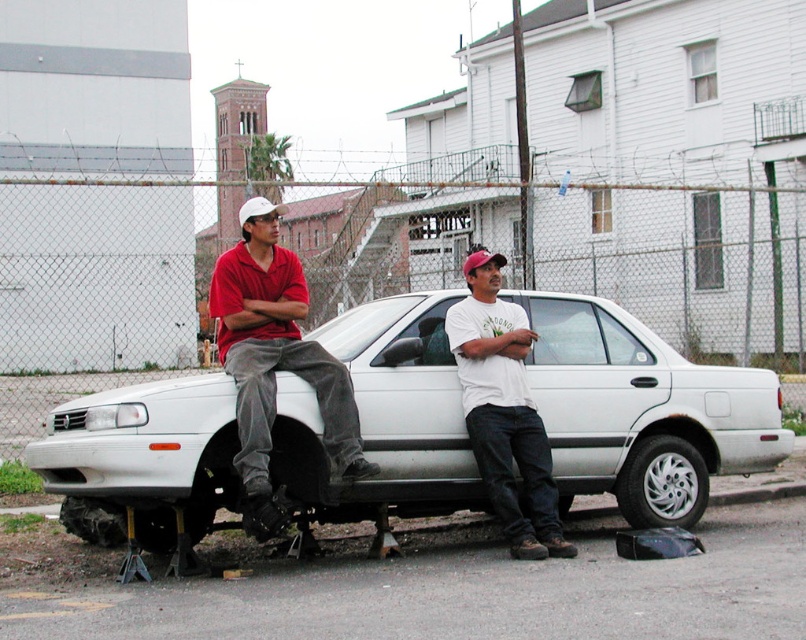
Question: Can you confirm if matte red shirt at left is positioned to the left of white matte car at center?

Choices:
 (A) no
 (B) yes

Answer: (B)

Question: Can you confirm if white matte sedan at center is thinner than matte red shirt at left?

Choices:
 (A) no
 (B) yes

Answer: (A)

Question: Where is white matte sedan at center located in relation to white matte car at center in the image?

Choices:
 (A) right
 (B) left

Answer: (A)

Question: Which of these objects is positioned closest to the white matte sedan at center?

Choices:
 (A) white matte car at center
 (B) matte red shirt at left

Answer: (A)

Question: Which point appears farthest from the camera in this image?

Choices:
 (A) (258, 531)
 (B) (676, 388)
 (C) (460, 305)

Answer: (B)

Question: Which of these objects is positioned farthest from the white matte car at center?

Choices:
 (A) white matte sedan at center
 (B) matte red shirt at left

Answer: (B)